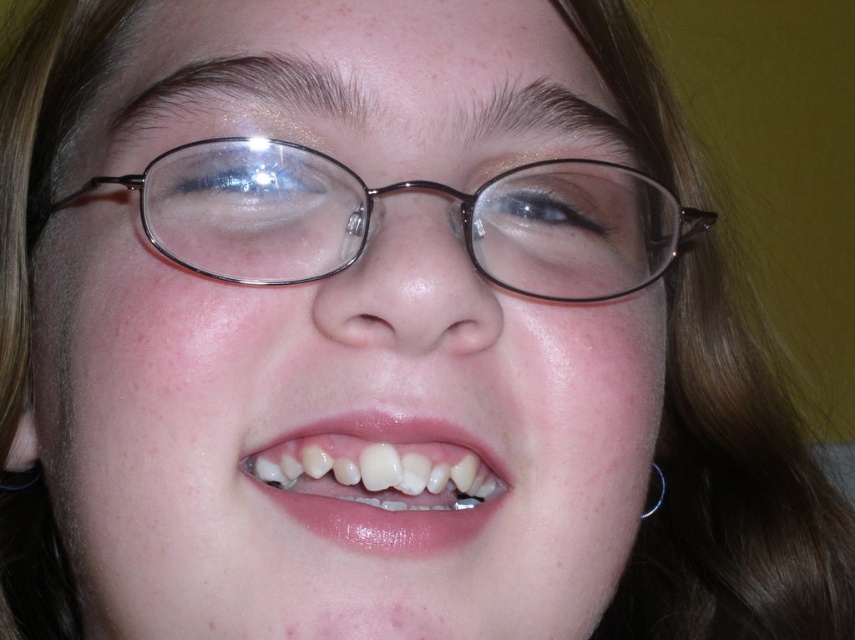
Question: Which object appears closest to the camera in this image?

Choices:
 (A) metallic frame glasses at center
 (B) translucent plastic teeth at center

Answer: (B)

Question: Can you confirm if metallic frame glasses at center is positioned to the right of translucent plastic teeth at center?

Choices:
 (A) no
 (B) yes

Answer: (B)

Question: Is the position of metallic frame glasses at center more distant than that of translucent plastic teeth at center?

Choices:
 (A) yes
 (B) no

Answer: (A)

Question: Which point is closer to the camera taking this photo?

Choices:
 (A) (478, 470)
 (B) (305, 262)

Answer: (B)

Question: Can you confirm if metallic frame glasses at center is wider than translucent plastic teeth at center?

Choices:
 (A) no
 (B) yes

Answer: (B)

Question: Which of the following is the closest to the observer?

Choices:
 (A) (513, 291)
 (B) (455, 458)

Answer: (A)